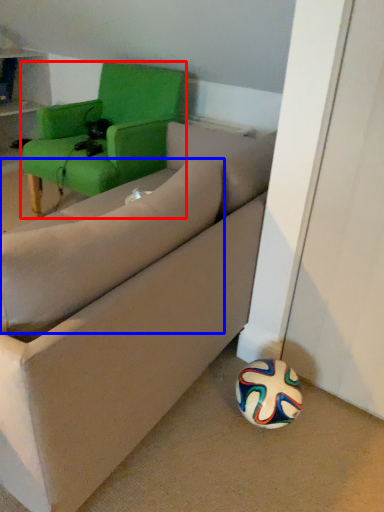
Question: Which object is further to the camera taking this photo, chair (highlighted by a red box) or pillow (highlighted by a blue box)?

Choices:
 (A) chair
 (B) pillow

Answer: (A)